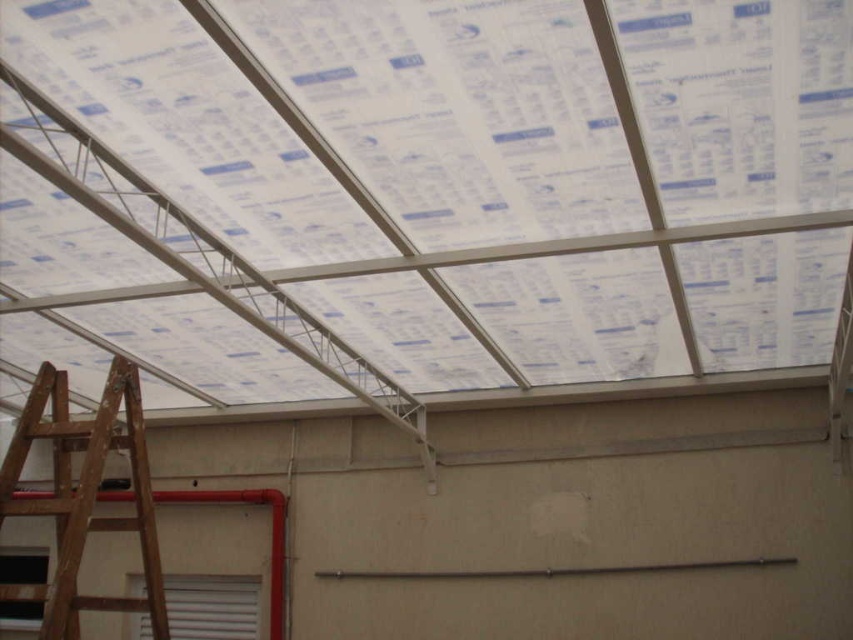
You are a construction worker who needs to move a tool from the wooden ladder at lower left to the transparent plastic roof at center. Can you fit the tool between them without removing either object?

The transparent plastic roof at center occupies less space than wooden ladder at lower left, so there is enough space to move the tool between them without removing either object.

Consider the image. What are the coordinates of the transparent plastic roof at center?

The transparent plastic roof at center is located at coordinates point (426, 189).